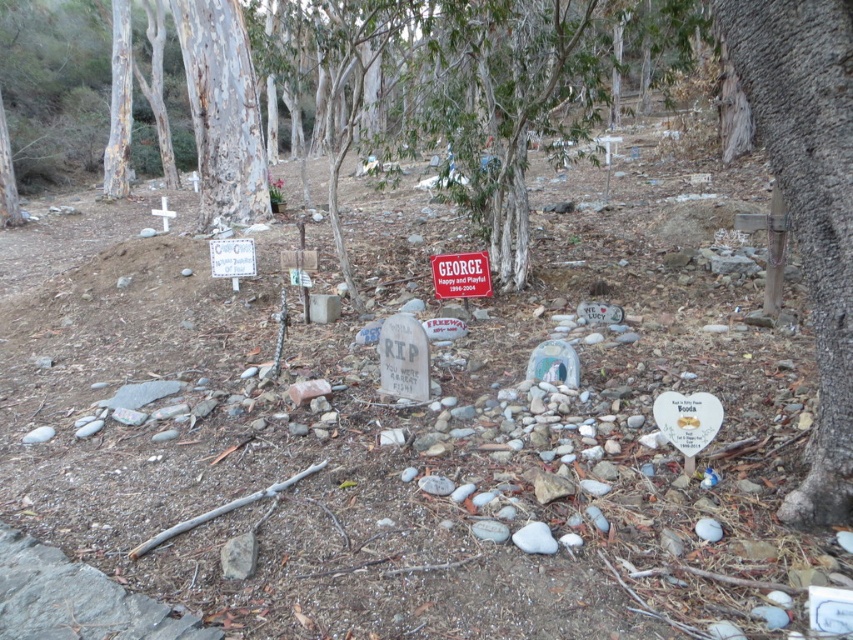
Question: Among these points, which one is nearest to the camera?

Choices:
 (A) (114, 193)
 (B) (398, 317)

Answer: (B)

Question: Among these points, which one is farthest from the camera?

Choices:
 (A) (109, 138)
 (B) (814, 493)
 (C) (223, 13)

Answer: (A)

Question: Is brown rough bark tree at right thinner than white smooth tree trunk at upper center?

Choices:
 (A) no
 (B) yes

Answer: (B)

Question: Does rip paper tombstone at center appear on the right side of red plastic sign at center?

Choices:
 (A) yes
 (B) no

Answer: (B)

Question: Which of the following is the closest to the observer?

Choices:
 (A) (730, 13)
 (B) (389, 374)

Answer: (A)

Question: Considering the relative positions of brown rough bark tree at right and smooth bark tree at upper left in the image provided, where is brown rough bark tree at right located with respect to smooth bark tree at upper left?

Choices:
 (A) below
 (B) above

Answer: (A)